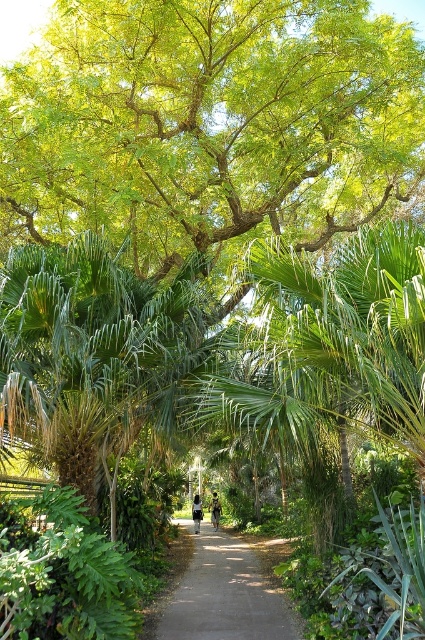
Who is shorter, green leafy tree at upper center or green leafy palm tree at center?

Standing shorter between the two is green leafy tree at upper center.

How much distance is there between green leafy tree at upper center and green leafy palm tree at center?

green leafy tree at upper center is 10.32 feet from green leafy palm tree at center.

Who is more distant from viewer, [108,132] or [158,419]?

The point [108,132] is more distant.

Where is `green leafy tree at upper center`? green leafy tree at upper center is located at coordinates (209, 125).

Is green leafy tree at upper center smaller than dirt/gravel path at center?

Correct, green leafy tree at upper center occupies less space than dirt/gravel path at center.

Which is more to the left, green leafy tree at upper center or dirt/gravel path at center?

Positioned to the left is green leafy tree at upper center.

Does point (71, 17) lie behind point (224, 624)?

That is True.

Find the location of a particular element. The height and width of the screenshot is (640, 425). green leafy tree at upper center is located at coordinates (209, 125).

Which is below, green leafy palm tree at center or dirt/gravel path at center?

dirt/gravel path at center is lower down.

Who is higher up, green leafy palm tree at center or dirt/gravel path at center?

green leafy palm tree at center is above.

Which is behind, point (33, 342) or point (172, 609)?

The point (172, 609) is behind.

Image resolution: width=425 pixels, height=640 pixels. Identify the location of green leafy palm tree at center. (93, 356).